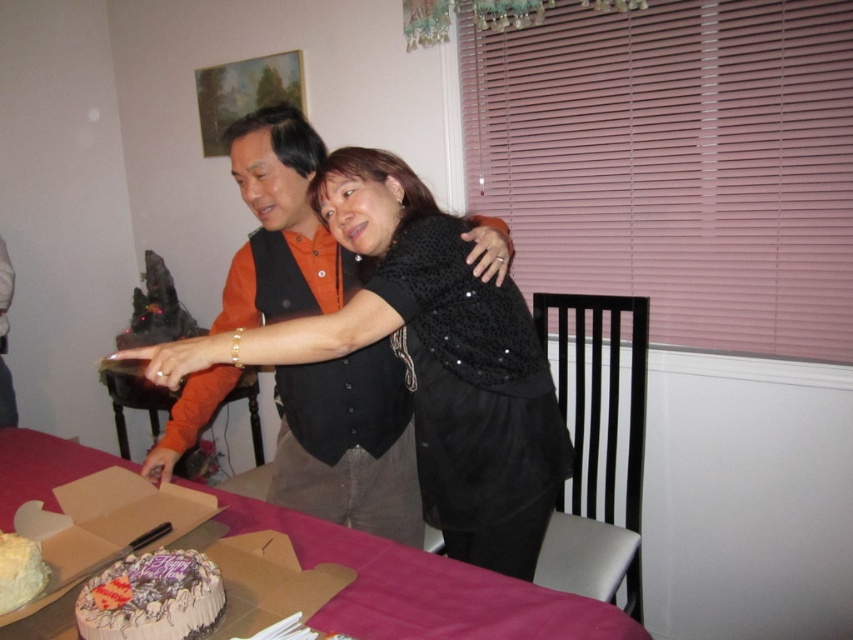
You are a photographer standing at the origin point of the coordinate system. The image you are viewing has a coordinate system where the bottom left corner is the origin. You want to capture a closeup shot of the black sequined dress at center. According to the coordinates provided, where should you aim your camera?

The black sequined dress at center is located at coordinates point (426, 358), so you should aim your camera at that point to capture the closeup shot.

You are a guest at the celebration and want to take a photo of the chocolate frosted cake at center. Since the pink fabric table at center is blocking part of the cake, can you move the table to get a clear shot?

The pink fabric table at center is positioned under the chocolate frosted cake at center, so moving the table might disrupt the cake. You should adjust your angle instead.